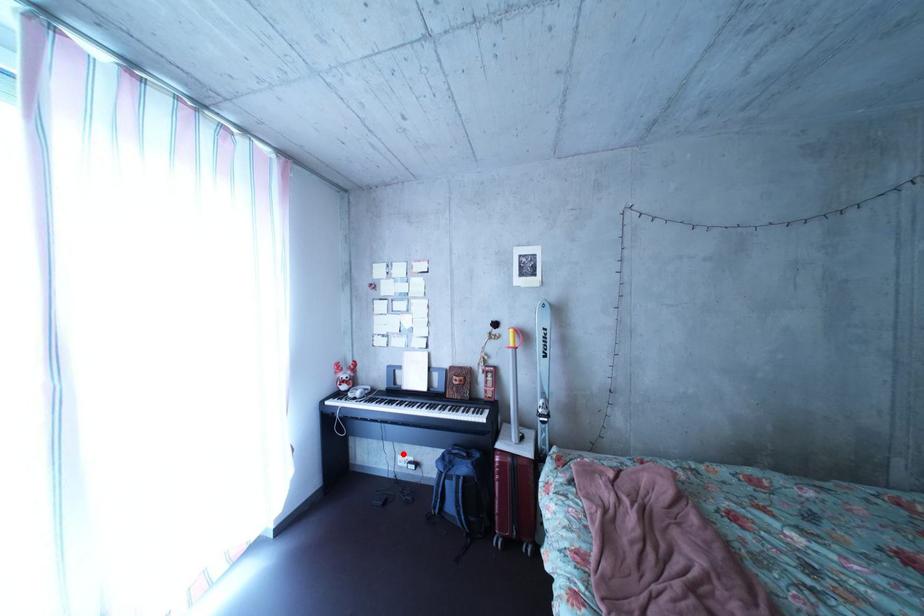
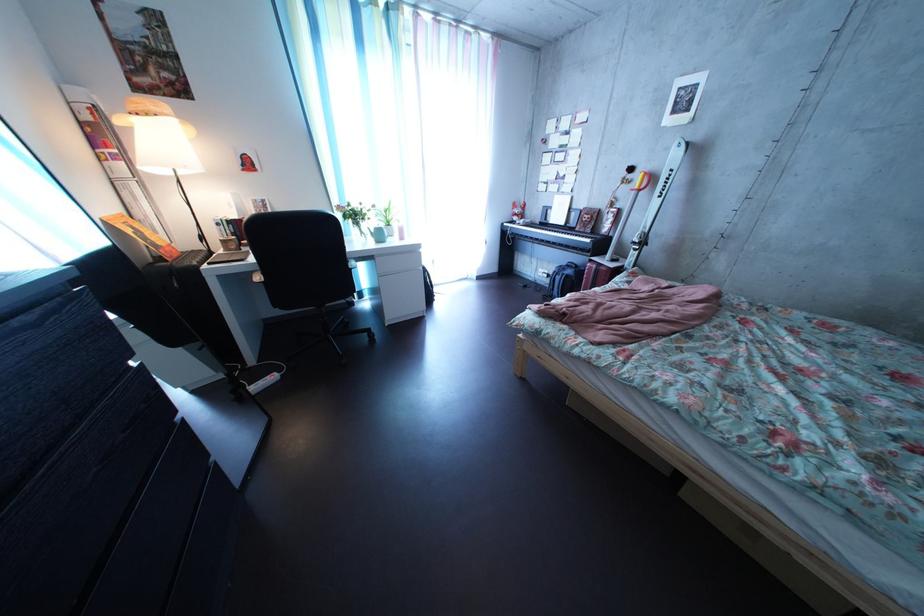
Where in the second image is the point corresponding to the highlighted location from the first image?

(550, 269)